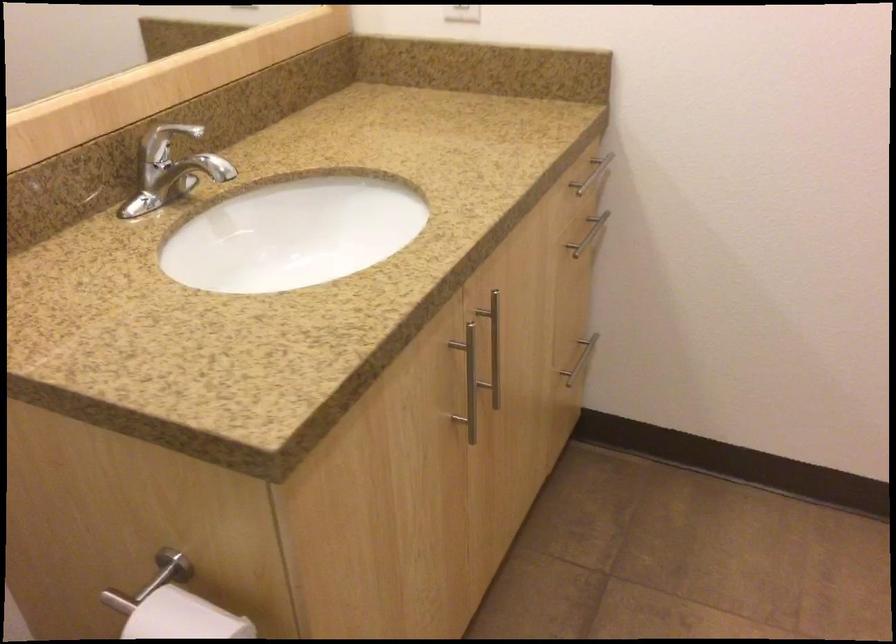
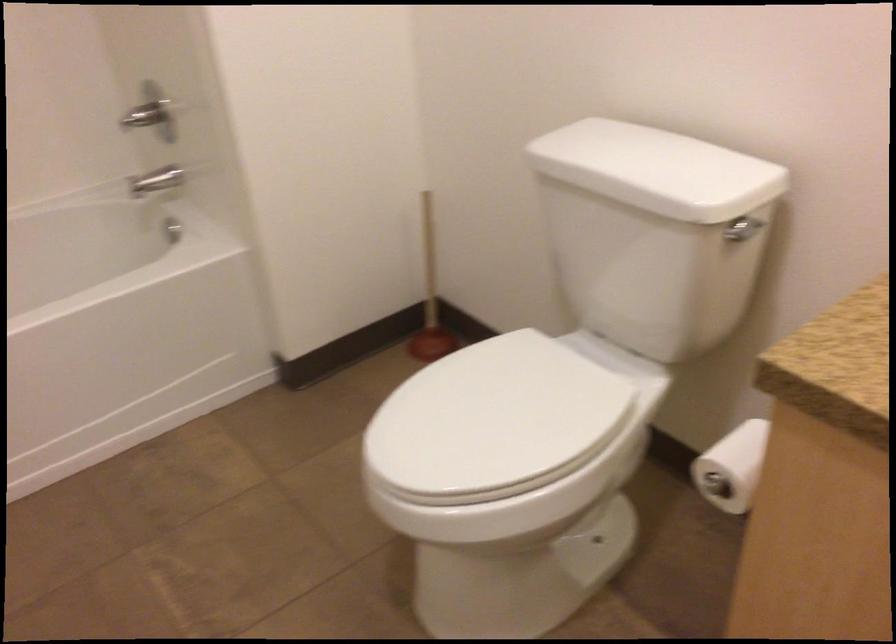
First-person continuous shooting, in which direction is the camera rotating?

The camera's rotation is toward left-down.